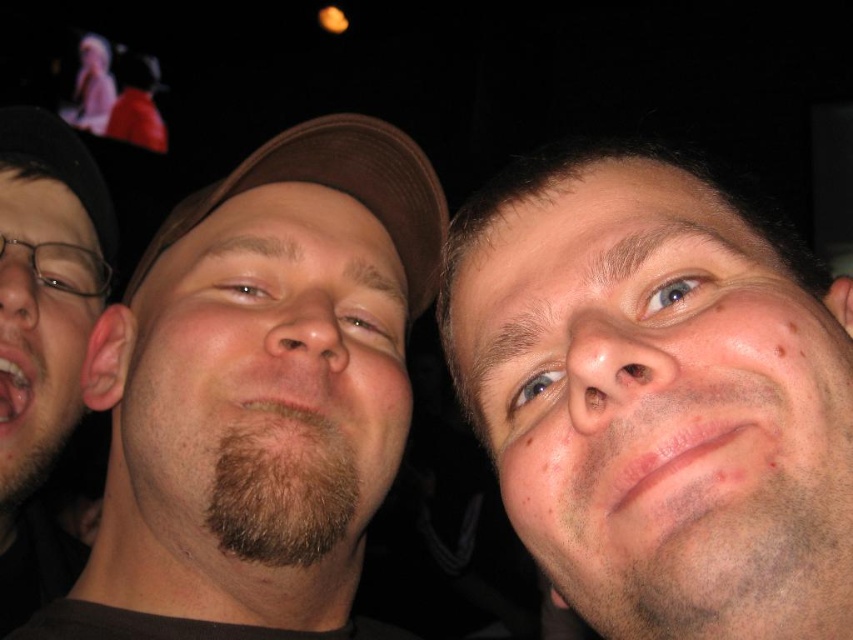
Is point (263, 284) in front of point (18, 380)?

Yes, it is.

Who is taller, brown beard at center or bearded man at left?

Standing taller between the two is bearded man at left.

This screenshot has height=640, width=853. In order to click on brown beard at center in this screenshot , I will do `click(267, 380)`.

Is brown matte cap at center closer to camera compared to brown fabric baseball cap at center?

Yes, it is in front of brown fabric baseball cap at center.

Who is positioned more to the right, brown matte cap at center or brown fabric baseball cap at center?

brown matte cap at center

At what (x,y) coordinates should I click in order to perform the action: click on brown matte cap at center. Please return your answer as a coordinate pair (x, y). Looking at the image, I should click on (258, 394).

Image resolution: width=853 pixels, height=640 pixels. What are the coordinates of `brown matte cap at center` in the screenshot? It's located at (258, 394).

Looking at this image, between bearded man at left and beige matte face at left, which one is positioned higher?

Positioned higher is beige matte face at left.

What do you see at coordinates (44, 337) in the screenshot?
I see `bearded man at left` at bounding box center [44, 337].

Identify the location of bearded man at left. The image size is (853, 640). (44, 337).